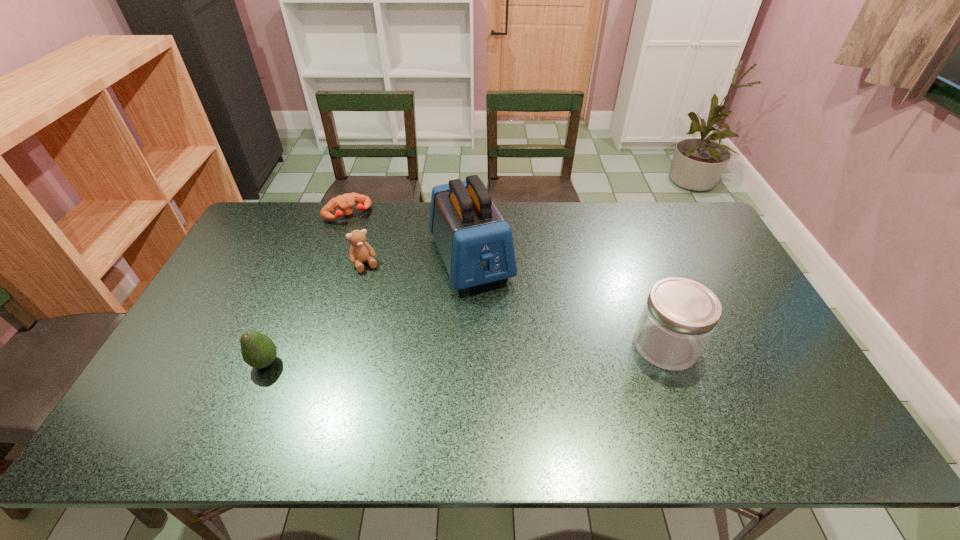
You are a GUI agent. You are given a task and a screenshot of the screen. Output one action in this format:
    pyautogui.click(x=<x>, y=<y>)
    Task: Click on the object situated at the near edge
    This screenshot has width=960, height=540.
    Given the screenshot: What is the action you would take?
    pyautogui.click(x=258, y=351)

In the image, there is a desktop. Identify the location of free space at the far edge. (588, 227).

Where is `free space at the near edge`? The width and height of the screenshot is (960, 540). free space at the near edge is located at coordinates (311, 376).

Image resolution: width=960 pixels, height=540 pixels. Find the location of `free space at the left edge`. free space at the left edge is located at coordinates (177, 357).

The image size is (960, 540). I want to click on vacant space at the right edge, so pyautogui.click(x=735, y=359).

The image size is (960, 540). In order to click on free space at the far left corner of the desktop in this screenshot , I will do `click(260, 210)`.

The height and width of the screenshot is (540, 960). What are the coordinates of `free space at the near right corner of the desktop` in the screenshot? It's located at (751, 380).

Where is `free point between the teddy bear and the toaster`? free point between the teddy bear and the toaster is located at coordinates (418, 261).

You are a GUI agent. You are given a task and a screenshot of the screen. Output one action in this format:
    pyautogui.click(x=<x>, y=<y>)
    Task: Click on the empty space between the teddy bear and the jar
    The image size is (960, 540).
    Given the screenshot: What is the action you would take?
    pyautogui.click(x=516, y=305)

In order to click on free space between the teddy bear and the avocado in this screenshot , I will do `click(315, 314)`.